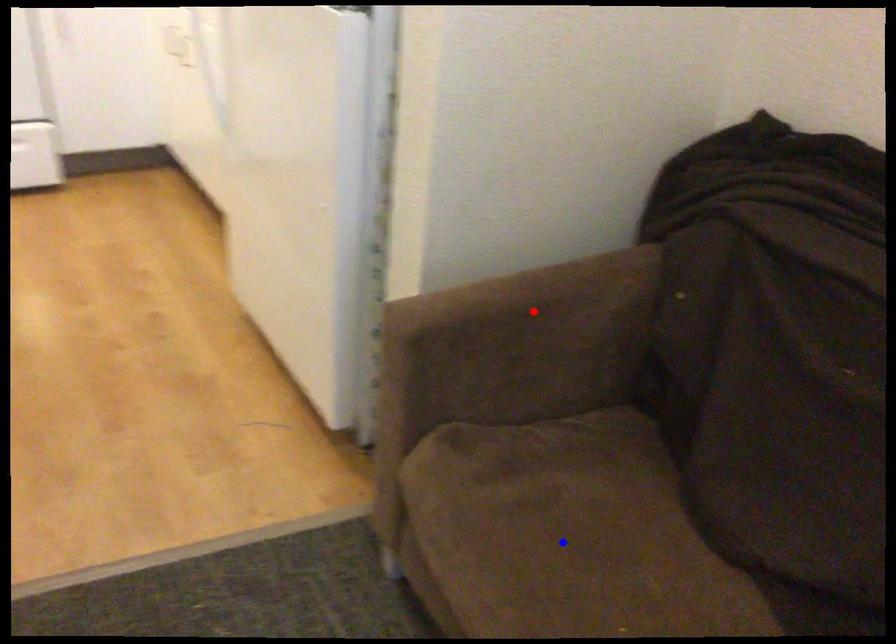
Question: Which of the two points in the image is closer to the camera?

Choices:
 (A) Blue point is closer.
 (B) Red point is closer.

Answer: (A)